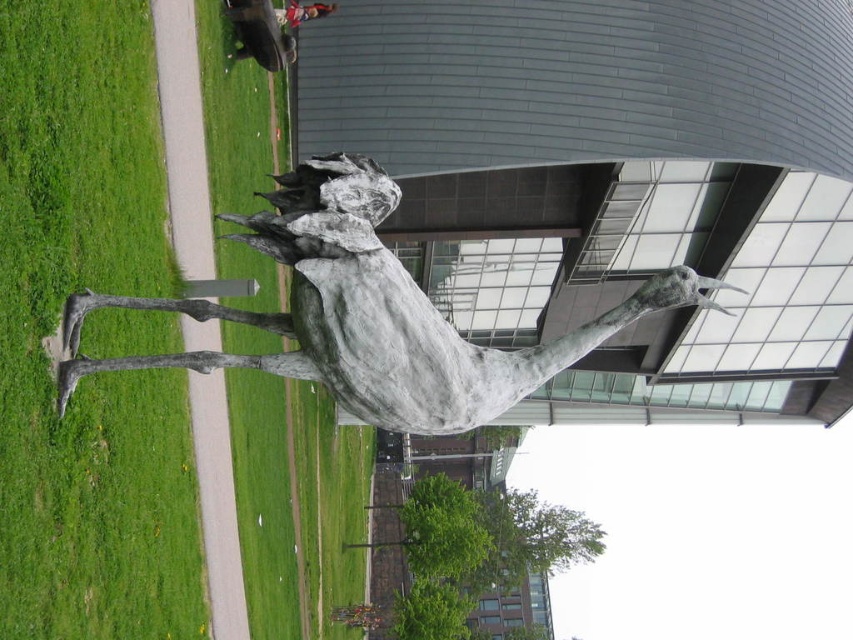
You are standing on the paved pathway and want to walk to the bronze horse at center. Which direction should you move relative to the green grass at left?

You should move to the right relative to the green grass at left because the bronze horse at center is to the right of the green grass at left.

You are a tourist standing in front of the modern building. You see the bronze horse at center and the red shirt at upper center. Which object is closer to your right side?

The bronze horse at center is to the right of the red shirt at upper center, so the bronze horse at center is closer to your right side.

What is the spatial relationship between the sculpture of a horse in mid leap and the green grass at left represented by point [57,323]?

The green grass at left represented by point [57,323] is located to the left of the sculpture of a horse in mid leap.